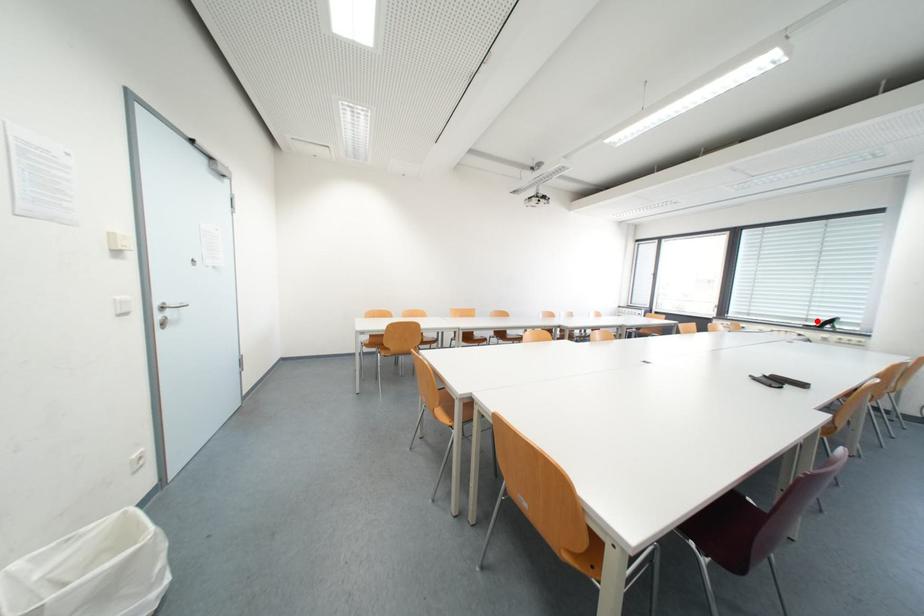
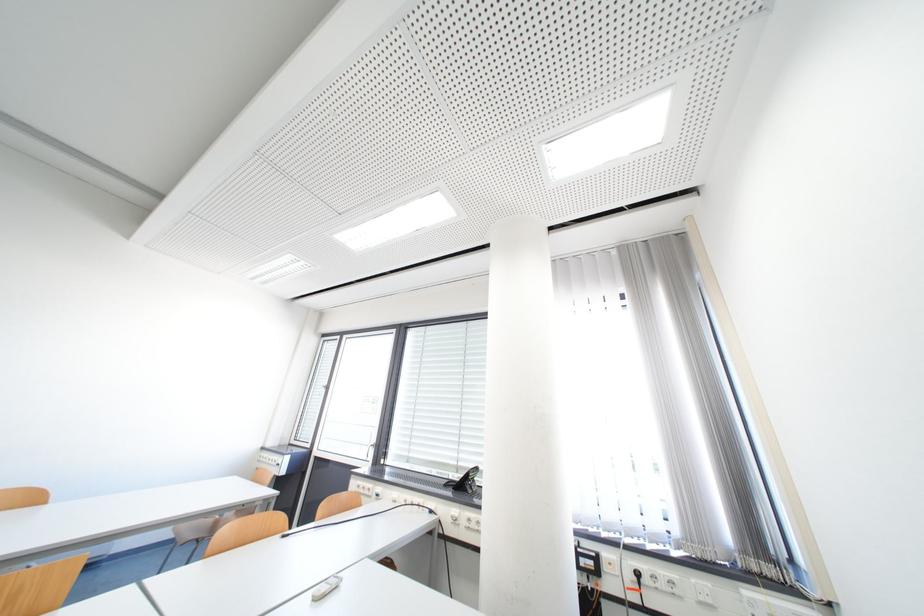
Find the pixel in the second image that matches the highlighted location in the first image.

(468, 469)